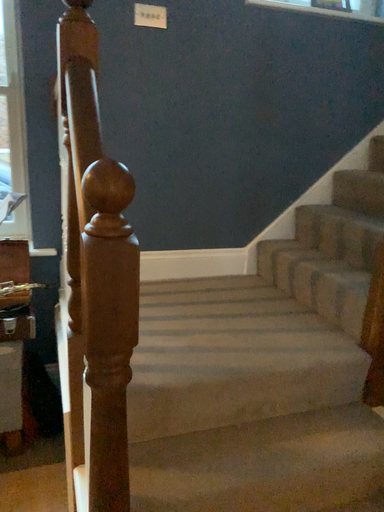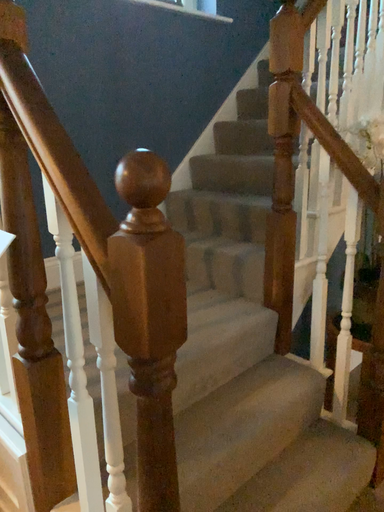
Question: How did the camera likely rotate when shooting the video?

Choices:
 (A) rotated left
 (B) rotated right

Answer: (B)